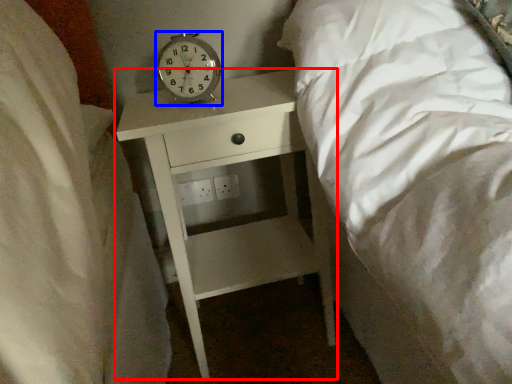
Question: Which object appears farthest to the camera in this image, nightstand (highlighted by a red box) or alarm clock (highlighted by a blue box)?

Choices:
 (A) nightstand
 (B) alarm clock

Answer: (B)